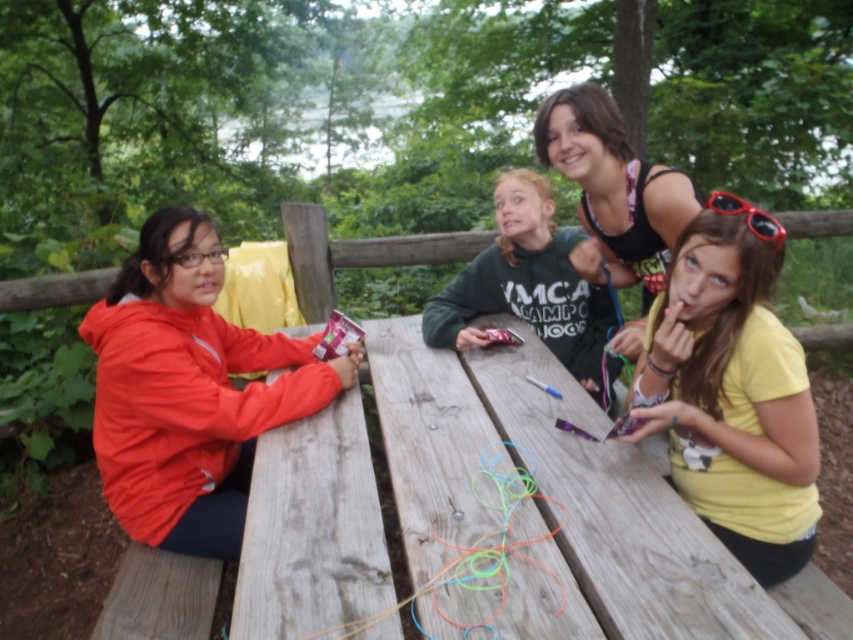
You are standing in front of the picnic table and want to pick up an item from the table. The first item is located at point (595, 188) and the second item is at point (459, 573). Which item is closer to you?

The point at (459, 573) is closer to you because it is less further to the camera than point (595, 188).

You are planning to place a large basket on the wooden picnic table at center. Considering the size of the neon rubber bands at center, will the basket fit entirely on the table without hanging over the edges?

The wooden picnic table at center is wider than the neon rubber bands at center, so the basket should fit as long as it doesn not exceed the table width.

You are planning to place a large bowl of snacks on the wooden picnic table at center. However, there are neon rubber bands at center already on the table. Where should you place the bowl to avoid the rubber bands?

The wooden picnic table at center is positioned over the neon rubber bands at center, so placing the bowl on the table would cover the rubber bands. To avoid them, place the bowl on an empty area of the wooden picnic table at center not covered by the neon rubber bands at center.